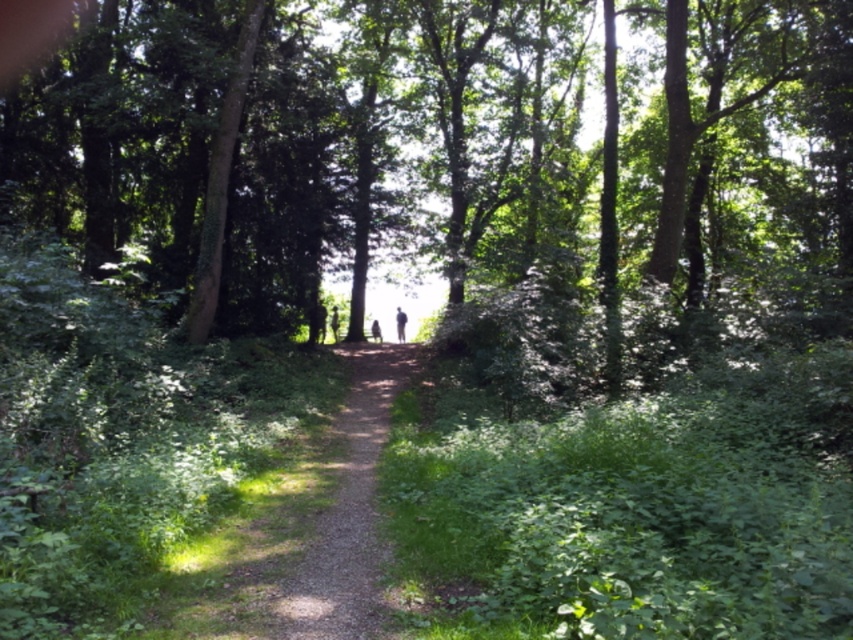
Who is taller, dirt path at center or dark brown leather jacket at center?

dark brown leather jacket at center is taller.

Is point (321, 435) closer to camera compared to point (379, 336)?

Yes, it is in front of point (379, 336).

Who is more forward, (329, 540) or (372, 332)?

Point (329, 540) is more forward.

At what (x,y) coordinates should I click in order to perform the action: click on dirt path at center. Please return your answer as a coordinate pair (x, y). This screenshot has width=853, height=640. Looking at the image, I should click on (296, 531).

Which of these two, dirt path at center or silhouette figure at center, stands taller?

silhouette figure at center

From the picture: Can you confirm if dirt path at center is smaller than silhouette figure at center?

No.

Which is behind, point (241, 561) or point (335, 326)?

The point (335, 326) is behind.

Where is `dirt path at center`? Image resolution: width=853 pixels, height=640 pixels. dirt path at center is located at coordinates (296, 531).

Does dirt path at center appear under blurred figure at center?

Indeed, dirt path at center is positioned under blurred figure at center.

Does dirt path at center appear on the right side of blurred figure at center?

In fact, dirt path at center is to the left of blurred figure at center.

What do you see at coordinates (296, 531) in the screenshot? I see `dirt path at center` at bounding box center [296, 531].

The height and width of the screenshot is (640, 853). I want to click on dirt path at center, so click(296, 531).